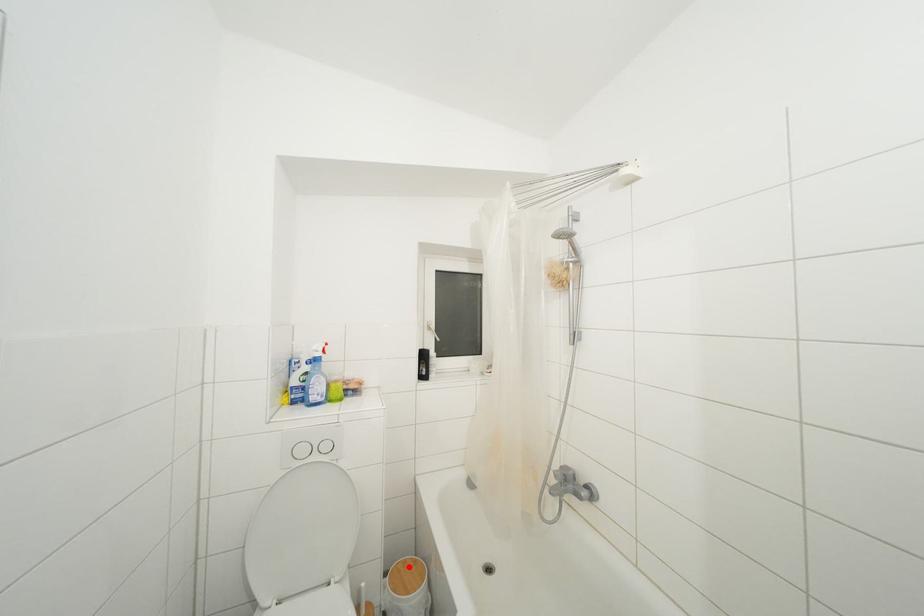
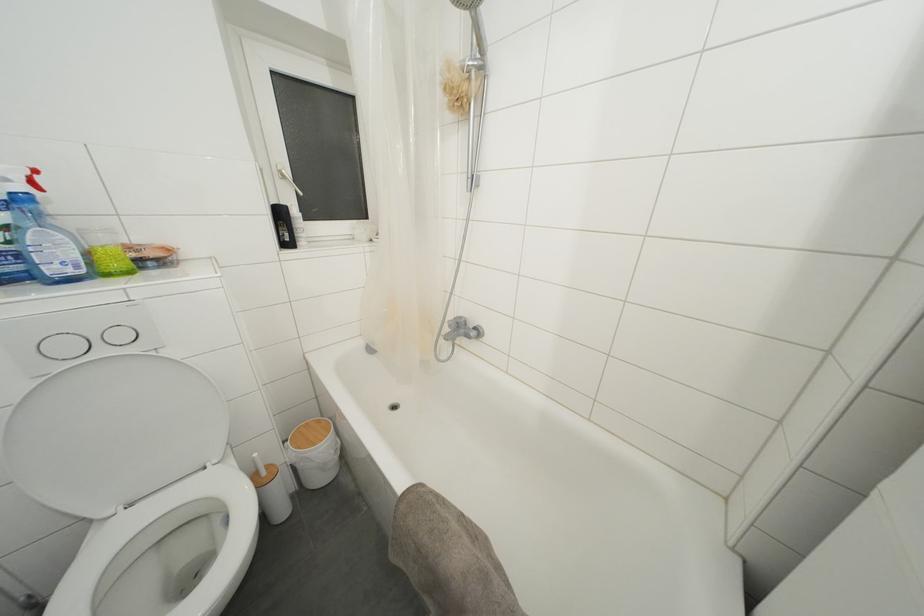
Where in the second image is the point corresponding to the highlighted location from the first image?

(310, 429)